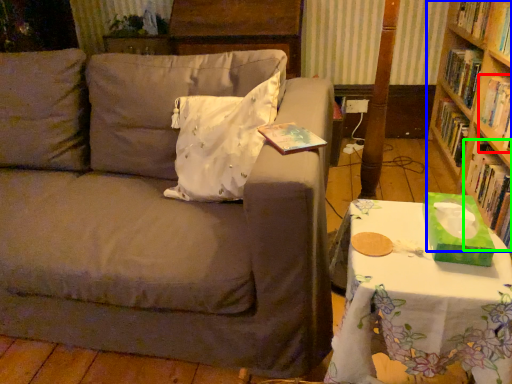
Question: Based on their relative distances, which object is nearer to book (highlighted by a red box)? Choose from bookcase (highlighted by a blue box) and book (highlighted by a green box).

Choices:
 (A) bookcase
 (B) book

Answer: (B)